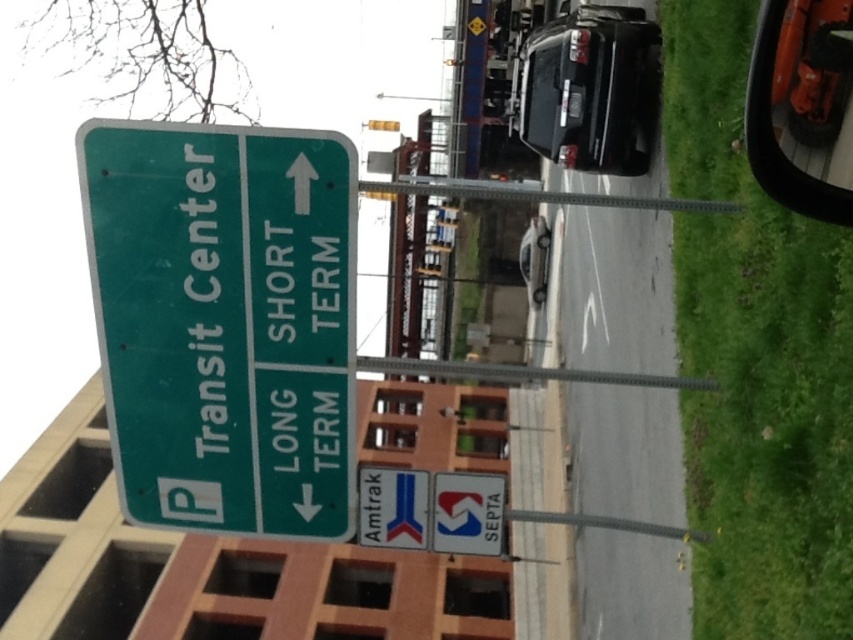
Between point (805, 106) and point (432, 515), which one is positioned behind?

The point (432, 515) is behind.

Does orange plastic view mirror at upper right appear over white plastic sign at lower center?

Correct, orange plastic view mirror at upper right is located above white plastic sign at lower center.

The image size is (853, 640). In order to click on orange plastic view mirror at upper right in this screenshot , I will do `click(802, 106)`.

Between orange plastic view mirror at upper right and shiny black truck at upper right, which one is positioned higher?

shiny black truck at upper right is higher up.

Who is more distant from viewer, (x=753, y=113) or (x=618, y=109)?

Point (x=618, y=109)

Find the location of a particular element. orange plastic view mirror at upper right is located at coordinates (802, 106).

Does shiny black truck at upper right have a larger size compared to white plastic sign at lower center?

Yes, shiny black truck at upper right is bigger than white plastic sign at lower center.

Is shiny black truck at upper right smaller than white plastic sign at lower center?

Incorrect, shiny black truck at upper right is not smaller in size than white plastic sign at lower center.

The image size is (853, 640). Find the location of `shiny black truck at upper right`. shiny black truck at upper right is located at coordinates (590, 90).

This screenshot has width=853, height=640. I want to click on shiny black truck at upper right, so click(590, 90).